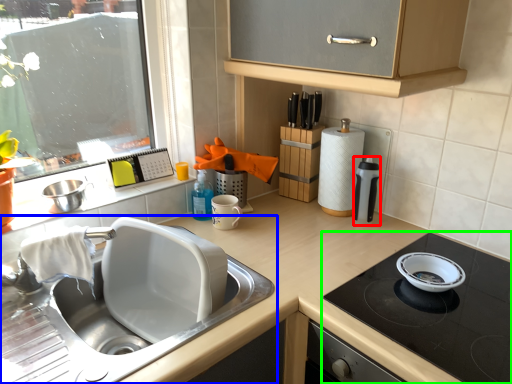
Question: Considering the real-world distances, which object is closest to kitchen appliance (highlighted by a red box)? sink (highlighted by a blue box) or gas stove (highlighted by a green box).

Choices:
 (A) sink
 (B) gas stove

Answer: (B)